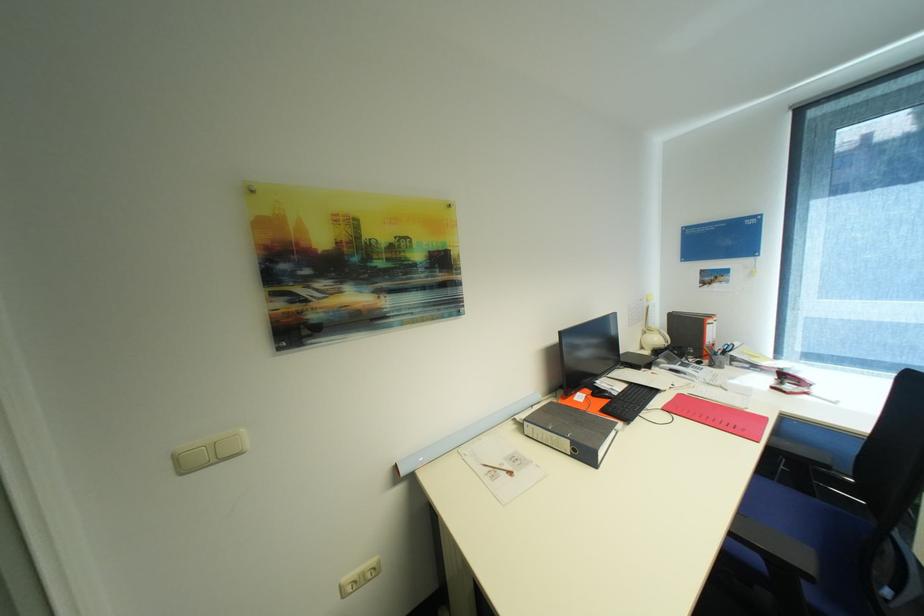
Which object does [718,416] point to?

This point indicates the red binder.